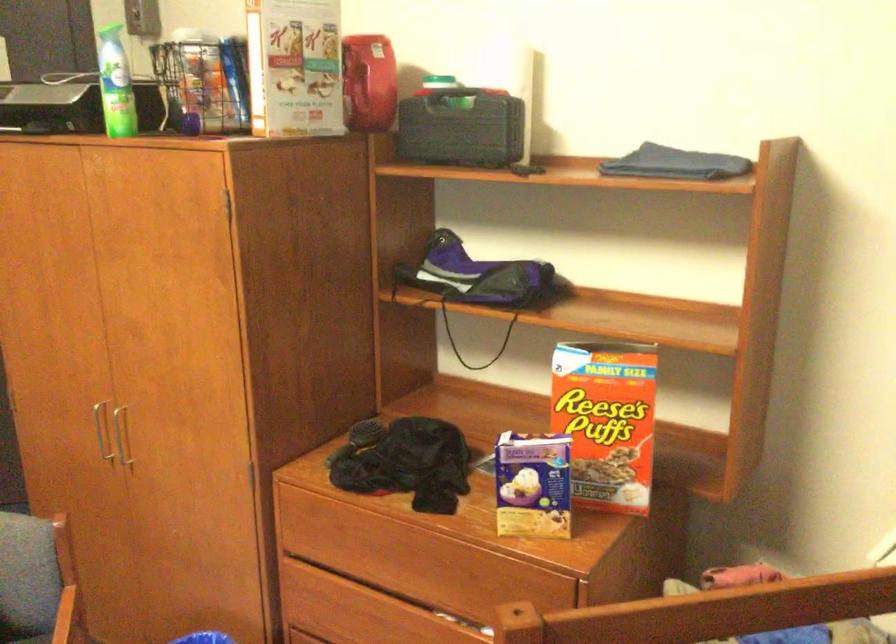
Which object does [295,67] point to?

This point indicates the white product box.